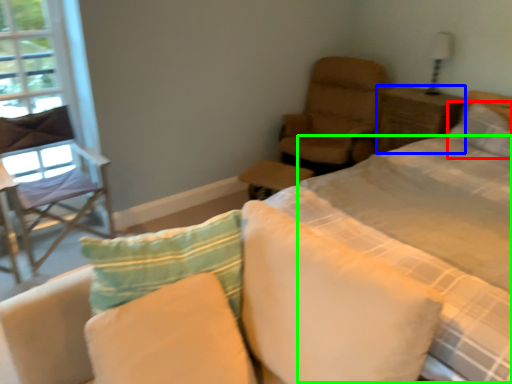
Question: Which object is the closest to the pillow (highlighted by a red box)? Choose among these: nightstand (highlighted by a blue box) or quilt (highlighted by a green box).

Choices:
 (A) nightstand
 (B) quilt

Answer: (A)